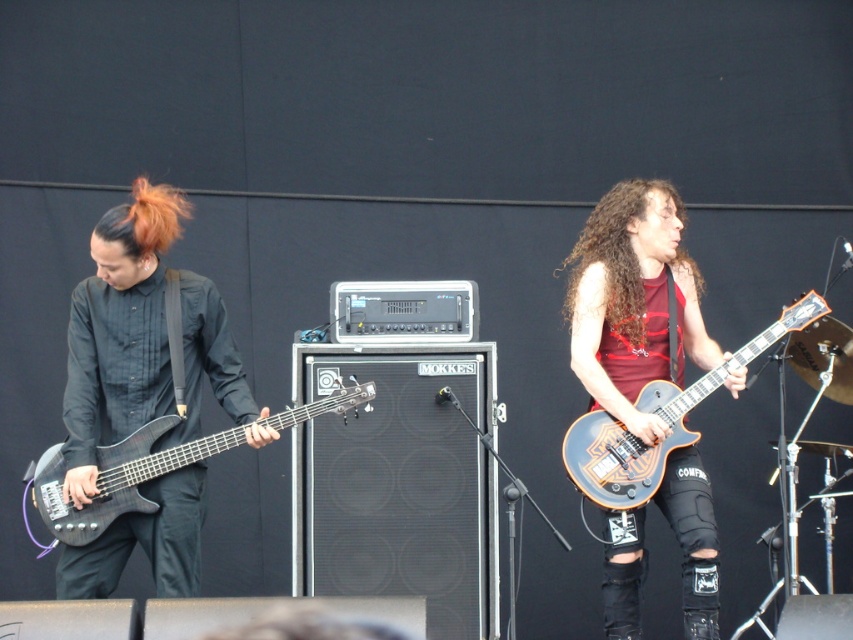
Which is in front, point (67, 464) or point (592, 376)?

Point (67, 464)

Is point (158, 358) more distant than point (689, 452)?

No.

Find the location of `matte black bass guitar at left`. matte black bass guitar at left is located at coordinates (119, 332).

Locate an element on the screen. The width and height of the screenshot is (853, 640). matte black bass guitar at left is located at coordinates (119, 332).

Which is in front, point (614, 624) or point (64, 461)?

Positioned in front is point (64, 461).

Between point (589, 387) and point (135, 476), which one is positioned behind?

Point (589, 387)

You are a GUI agent. You are given a task and a screenshot of the screen. Output one action in this format:
    pyautogui.click(x=<x>, y=<y>)
    Task: Click on the shiny orange guitar at center
    This screenshot has height=640, width=853.
    Given the screenshot: What is the action you would take?
    634,301

Between matte black bass guitar at left and matte black bass at left, which one appears on the left side from the viewer's perspective?

Positioned to the left is matte black bass guitar at left.

Is matte black bass guitar at left smaller than matte black bass at left?

No, matte black bass guitar at left is not smaller than matte black bass at left.

Is point (175, 580) less distant than point (231, 436)?

Yes, it is.

I want to click on matte black bass guitar at left, so click(x=119, y=332).